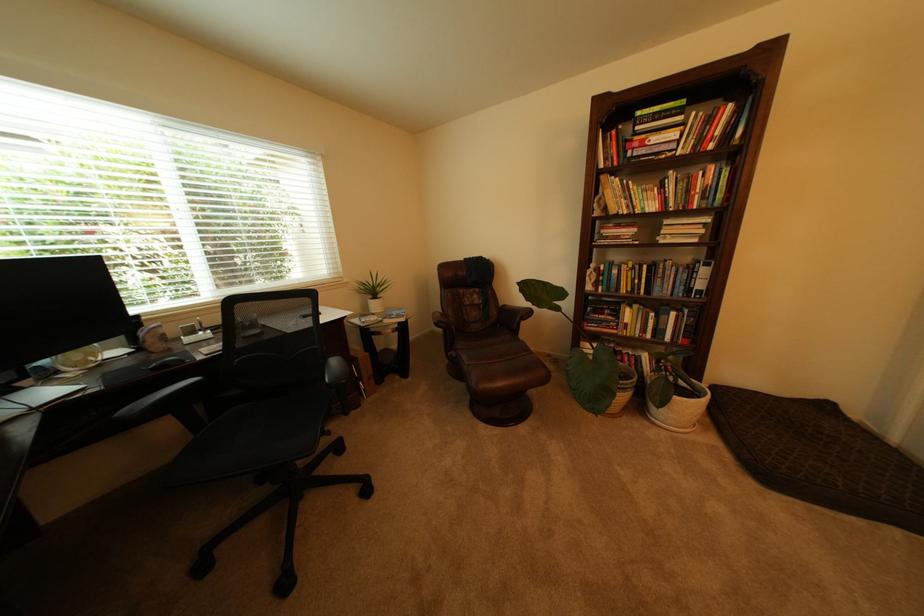
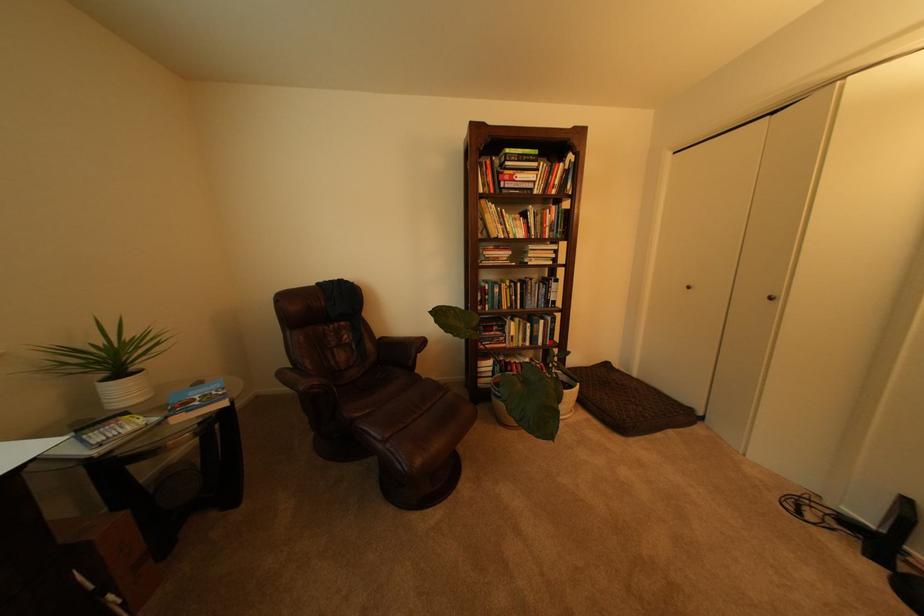
In the second image, find the point that corresponds to [613,209] in the first image.

(492, 232)